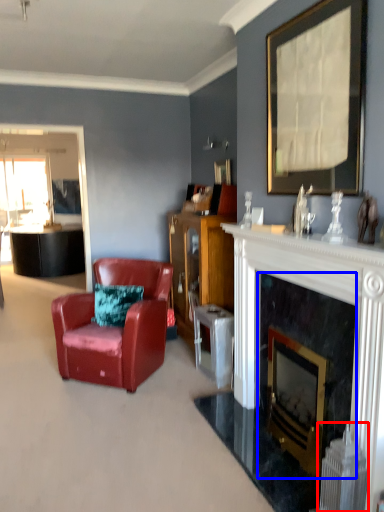
Question: Which object is closer to the camera taking this photo, radiator (highlighted by a red box) or fireplace (highlighted by a blue box)?

Choices:
 (A) radiator
 (B) fireplace

Answer: (A)